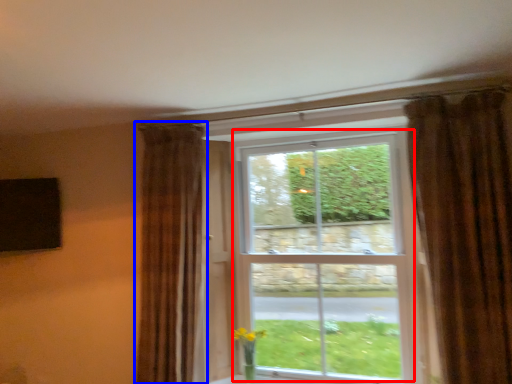
Question: Which object appears closest to the camera in this image, bay window (highlighted by a red box) or curtain (highlighted by a blue box)?

Choices:
 (A) bay window
 (B) curtain

Answer: (B)